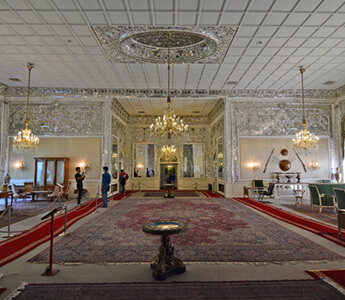
Locate an element on the screen. The height and width of the screenshot is (300, 345). red thin carpet is located at coordinates [x=32, y=236], [x=315, y=227], [x=208, y=192], [x=131, y=191].